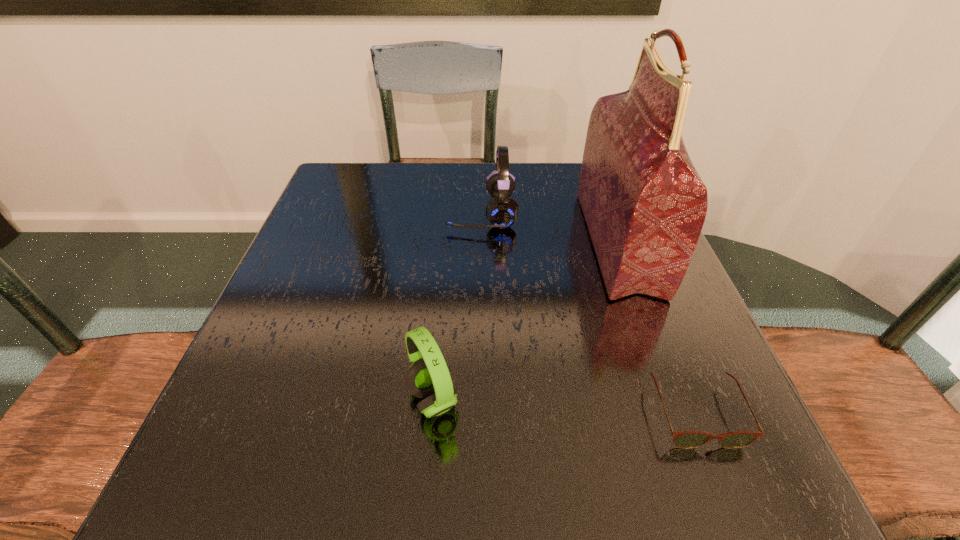
Find the location of a particular element. This screenshot has height=540, width=960. the tallest object is located at coordinates (644, 203).

I want to click on the farther headset, so click(502, 211).

This screenshot has width=960, height=540. Find the location of `the nearer headset`. the nearer headset is located at coordinates (428, 377).

Where is `the shortest object`? the shortest object is located at coordinates (684, 439).

Where is `blank space located on the front-facing side of the handbag`? blank space located on the front-facing side of the handbag is located at coordinates (544, 241).

Identify the location of vacant area situated on the front-facing side of the handbag. This screenshot has width=960, height=540. (435, 241).

This screenshot has height=540, width=960. In order to click on free location located on the front-facing side of the handbag in this screenshot , I will do `click(430, 241)`.

Locate an element on the screen. Image resolution: width=960 pixels, height=540 pixels. blank space located 0.220m on the ear cushions of the farther headset is located at coordinates (354, 213).

Locate an element on the screen. This screenshot has width=960, height=540. free space located 0.260m on the ear cushions of the farther headset is located at coordinates (337, 213).

Image resolution: width=960 pixels, height=540 pixels. Identify the location of vacant space located on the ear cushions of the farther headset. (363, 213).